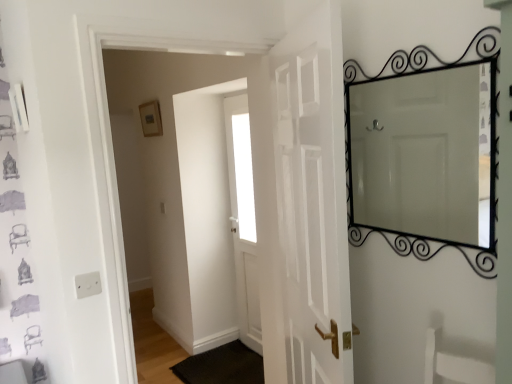
Question: Does point (228, 345) appear closer or farther from the camera than point (483, 107)?

Choices:
 (A) farther
 (B) closer

Answer: (A)

Question: Based on their sizes in the image, would you say black rubber doormat at lower center is bigger or smaller than black wrought iron mirror at upper right?

Choices:
 (A) big
 (B) small

Answer: (A)

Question: Which object is the farthest from the white glossy door at center, the first door in the front-to-back sequence?

Choices:
 (A) white matte door at center, arranged as the 2th door when viewed from the front
 (B) black wrought iron mirror at upper right
 (C) black rubber doormat at lower center
 (D) matte gold picture frame at upper center

Answer: (D)

Question: Which is farther from the white glossy door at center, positioned as the second door in back-to-front order?

Choices:
 (A) black wrought iron mirror at upper right
 (B) matte gold picture frame at upper center
 (C) black rubber doormat at lower center
 (D) white matte door at center, arranged as the 2th door when viewed from the front

Answer: (B)